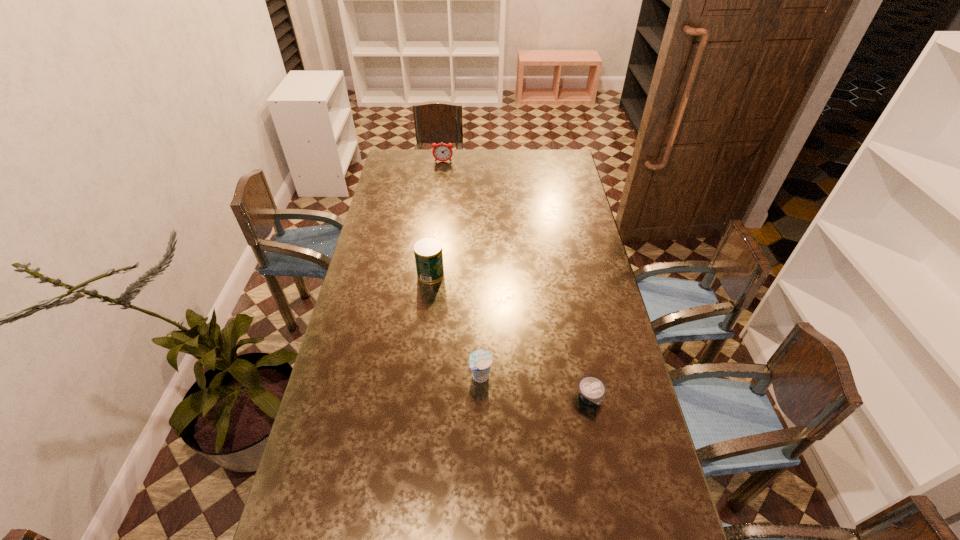
Locate an element on the screen. The height and width of the screenshot is (540, 960). blank area located on the left of the third tallest object is located at coordinates (411, 376).

Identify the location of vacant space located on the front of the shorter yogurt. This screenshot has height=540, width=960. click(613, 521).

Find the location of `object present at the far edge`. object present at the far edge is located at coordinates (442, 152).

Where is `object that is at the right edge`? The width and height of the screenshot is (960, 540). object that is at the right edge is located at coordinates (592, 390).

Locate an element on the screen. free region at the far edge is located at coordinates tap(473, 150).

The height and width of the screenshot is (540, 960). In order to click on blank space at the left edge of the desktop in this screenshot , I will do `click(362, 396)`.

Locate an element on the screen. The image size is (960, 540). free region at the right edge of the desktop is located at coordinates (610, 370).

Locate an element on the screen. free space at the far right corner of the desktop is located at coordinates (564, 159).

The image size is (960, 540). In order to click on blank region between the farthest object and the taller yogurt in this screenshot , I will do `click(462, 269)`.

Identify the location of unoccupied position between the rightmost object and the tallest object. The image size is (960, 540). (511, 336).